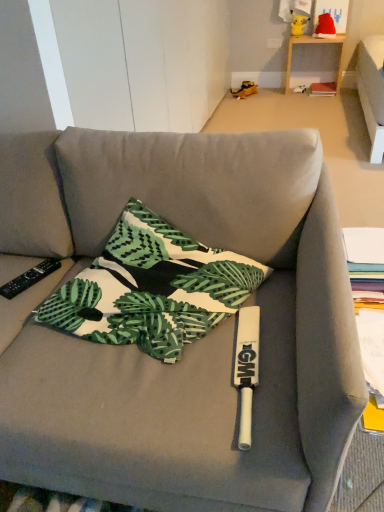
Question: From the image's perspective, is black plastic remote control at left above red fabric santa hat at upper right, the 2th toy in the left-to-right sequence?

Choices:
 (A) no
 (B) yes

Answer: (A)

Question: Does black plastic remote control at left have a lesser width compared to red fabric santa hat at upper right, placed as the first toy when sorted from right to left?

Choices:
 (A) no
 (B) yes

Answer: (A)

Question: Considering the relative sizes of black plastic remote control at left and red fabric santa hat at upper right, the 2th toy in the left-to-right sequence, in the image provided, is black plastic remote control at left wider than red fabric santa hat at upper right, the 2th toy in the left-to-right sequence,?

Choices:
 (A) yes
 (B) no

Answer: (A)

Question: Is black plastic remote control at left shorter than red fabric santa hat at upper right, placed as the first toy when sorted from right to left?

Choices:
 (A) no
 (B) yes

Answer: (B)

Question: Does black plastic remote control at left appear on the right side of red fabric santa hat at upper right, the 2th toy in the left-to-right sequence?

Choices:
 (A) no
 (B) yes

Answer: (A)

Question: Is red fabric santa hat at upper right, placed as the first toy when sorted from right to left, inside black plastic remote control at left?

Choices:
 (A) no
 (B) yes

Answer: (A)

Question: Is red fabric santa hat at upper right, placed as the first toy when sorted from right to left, located within hardcover book at center?

Choices:
 (A) no
 (B) yes

Answer: (A)

Question: Does hardcover book at center have a lesser width compared to red fabric santa hat at upper right, placed as the first toy when sorted from right to left?

Choices:
 (A) no
 (B) yes

Answer: (A)

Question: Could you tell me if hardcover book at center is facing red fabric santa hat at upper right, placed as the first toy when sorted from right to left?

Choices:
 (A) no
 (B) yes

Answer: (A)

Question: Is hardcover book at center bigger than red fabric santa hat at upper right, the 2th toy in the left-to-right sequence?

Choices:
 (A) no
 (B) yes

Answer: (A)

Question: Is hardcover book at center far away from red fabric santa hat at upper right, the 2th toy in the left-to-right sequence?

Choices:
 (A) yes
 (B) no

Answer: (B)

Question: Considering the relative positions of hardcover book at center and red fabric santa hat at upper right, placed as the first toy when sorted from right to left, in the image provided, is hardcover book at center to the right of red fabric santa hat at upper right, placed as the first toy when sorted from right to left, from the viewer's perspective?

Choices:
 (A) yes
 (B) no

Answer: (A)

Question: Is green leaf-patterned fabric pillow at center behind red fabric santa hat at upper right, the 2th toy in the left-to-right sequence?

Choices:
 (A) yes
 (B) no

Answer: (B)